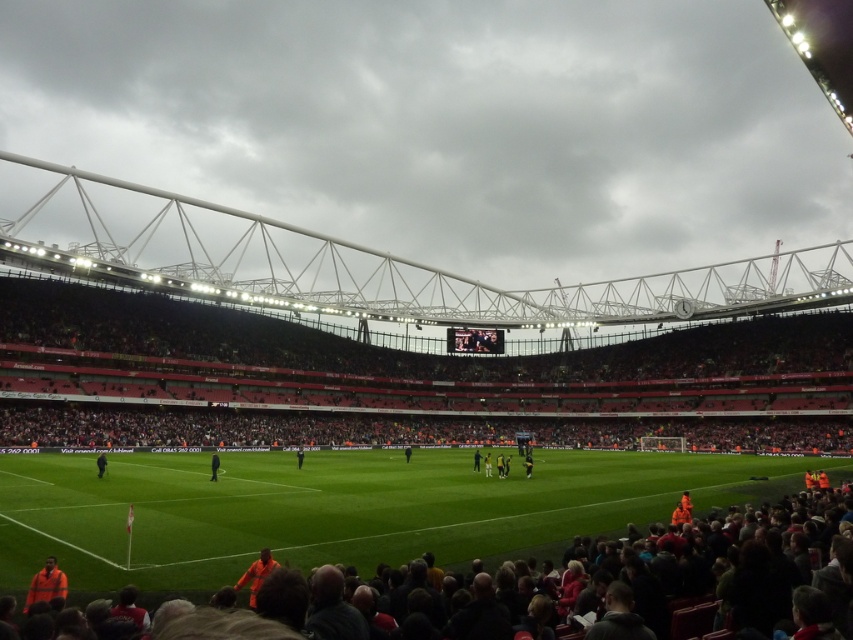
You are a photographer positioned at the edge of the soccer field. You notice two dark blue clothing items at the center of the field. Which one is closer to you, the dark blue uniform at center or the dark blue jersey at center?

The dark blue uniform at center is closer to you because it is in front of the dark blue jersey at center.